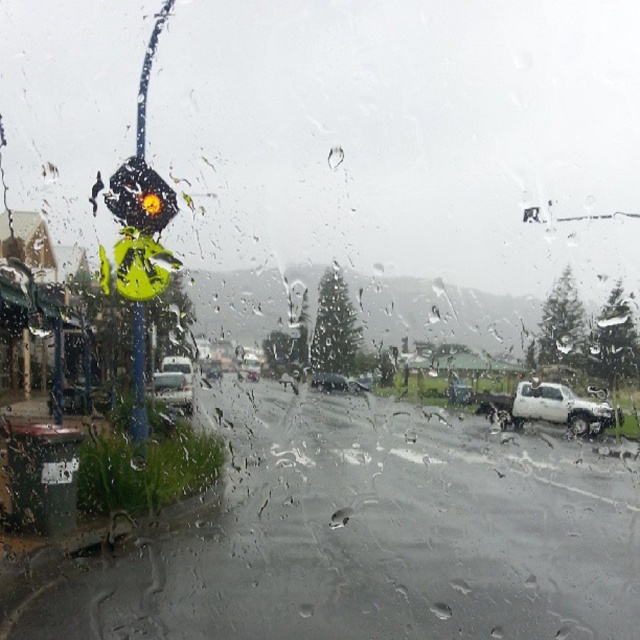
You are a delivery driver needing to park your vehicle in a narrow alley that can only accommodate vehicles up to 1.8 meters in width. You observe both the shiny black sedan at center and the metallic silver sedan at center in the scene. Which of these two vehicles is more likely to fit into the alley?

The metallic silver sedan at center has a narrower width than the shiny black sedan at center, so it is more likely to fit into the alley that can only accommodate vehicles up to 1.8 meters in width.

You are a pedestrian looking through the rainy window. You see the matte black stop light at upper left and the metallic silver sedan at center. Which object is closer to the left edge of the window?

The matte black stop light at upper left is closer to the left edge of the window because it is positioned to the left of the metallic silver sedan at center.

Consider the image. You are a delivery driver trying to park your vehicle in a space that can only accommodate a car as wide as the metallic silver sedan at center. You have a silver metallic sedan at center. Will your car fit in the parking space?

The silver metallic sedan at center might be wider than the metallic silver sedan at center. Therefore, there is uncertainty about whether your car will fit in the parking space. It is recommended to measure the space or choose a wider parking spot to ensure safety.